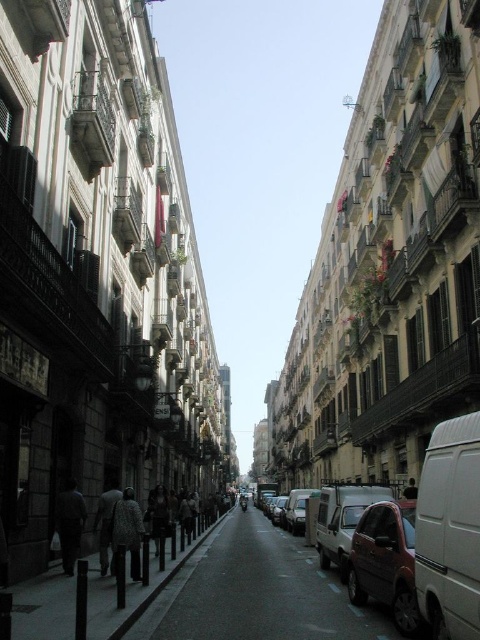
In the scene shown: Is white matte van at center shorter than metallic red car at center?

Incorrect, white matte van at center's height does not fall short of metallic red car at center's.

Find the location of `white matte van at center`. white matte van at center is located at coordinates (450, 531).

You are a GUI agent. You are given a task and a screenshot of the screen. Output one action in this format:
    pyautogui.click(x=<x>, y=<y>)
    Task: Click on the white matte van at center
    The width and height of the screenshot is (480, 640).
    Given the screenshot: What is the action you would take?
    pyautogui.click(x=450, y=531)

Who is shorter, white matte van at center or matte silver car at center?

Standing shorter between the two is white matte van at center.

Can you confirm if white matte van at center is wider than matte silver car at center?

Incorrect, white matte van at center's width does not surpass matte silver car at center's.

What are the coordinates of `white matte van at center` in the screenshot? It's located at (450, 531).

Between matte white van at center and matte silver car at center, which one has more height?

matte silver car at center

Does matte white van at center appear under matte silver car at center?

No.

Find the location of a particular element. The height and width of the screenshot is (640, 480). matte white van at center is located at coordinates (343, 518).